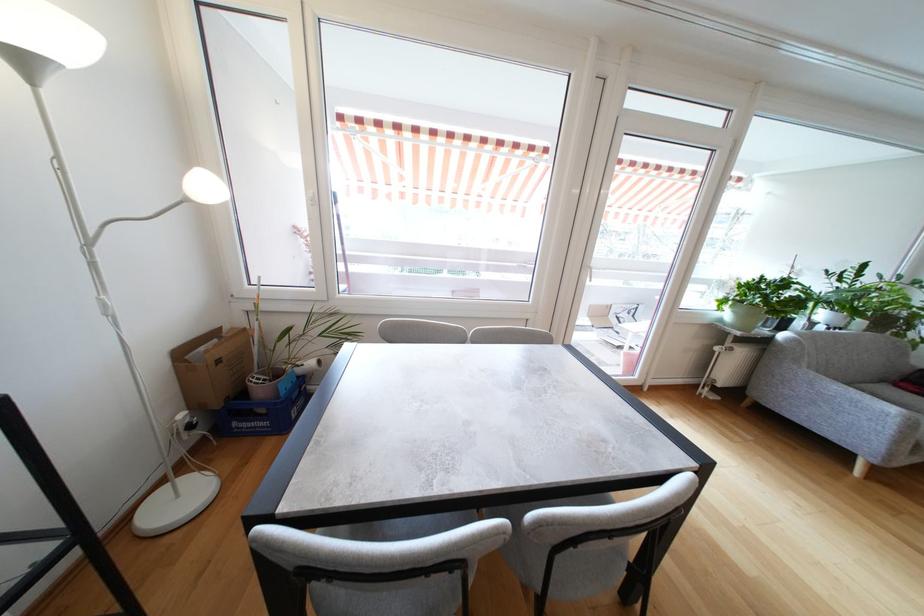
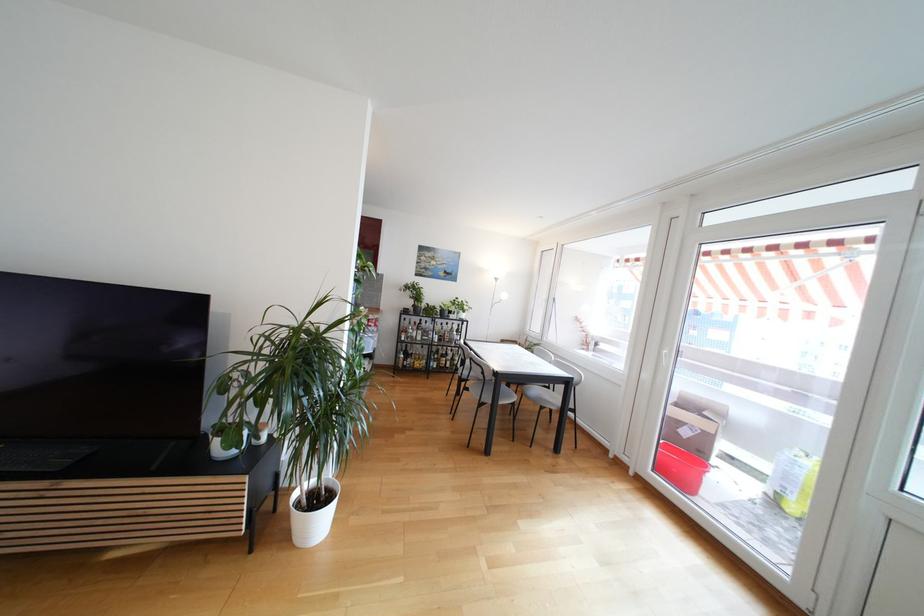
Question: I am providing you with two images of the same scene from different viewpoints. After the viewpoint changes to image2, which objects are now occluded?

Choices:
 (A) small white pot
 (B) black coat rack hook
 (C) glass bottle
 (D) cardboard box

Answer: (D)